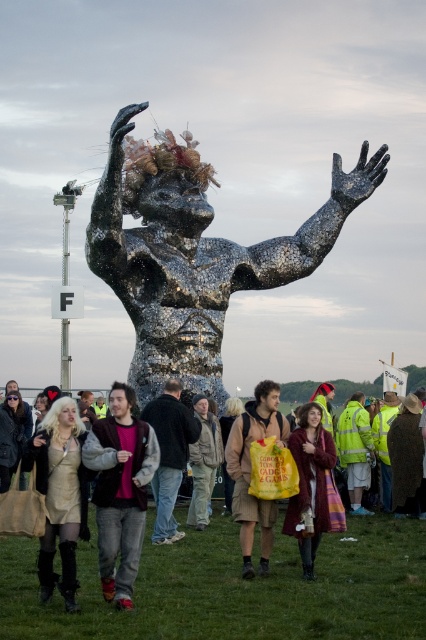
Question: Which object appears closest to the camera in this image?

Choices:
 (A) jeans at center
 (B) matte black jacket at center
 (C) shiny metallic coat at center

Answer: (B)

Question: Which object is the farthest from the gold metallic dress at center?

Choices:
 (A) matte black jacket at center
 (B) dark brown leather jacket at center
 (C) yellow reflective jacket at center
 (D) brown textured shorts at center

Answer: (C)

Question: Which point appears closest to the camera in this image?

Choices:
 (A) (46, 436)
 (B) (230, 467)
 (C) (213, 460)
 (D) (108, 483)

Answer: (D)

Question: Does shiny metallic coat at center appear over jeans at center?

Choices:
 (A) yes
 (B) no

Answer: (B)

Question: Does brown textured shorts at center lie behind jeans at center?

Choices:
 (A) yes
 (B) no

Answer: (B)

Question: Can you confirm if shiny metallic figure at center is bigger than yellow reflective jacket at center?

Choices:
 (A) yes
 (B) no

Answer: (A)